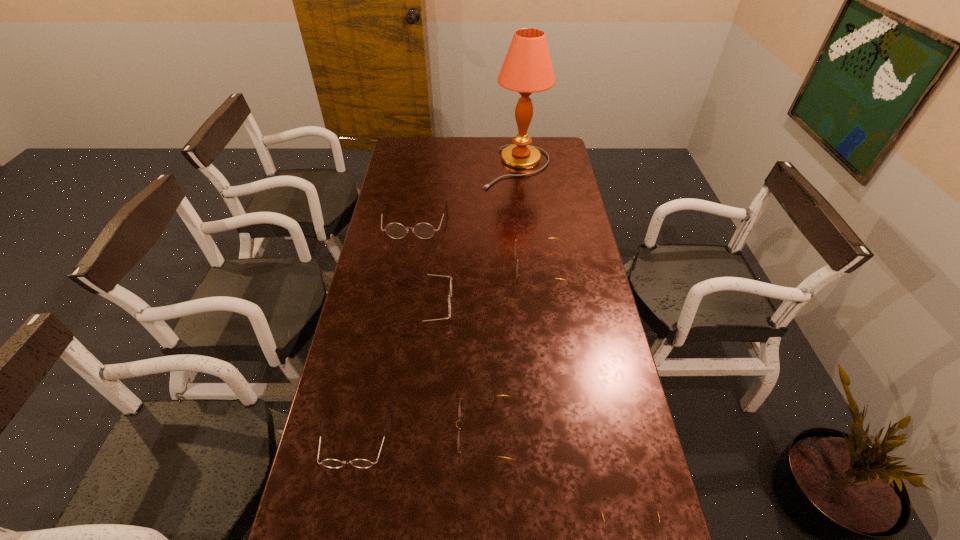
Where is `the farthest object`? This screenshot has height=540, width=960. the farthest object is located at coordinates (527, 68).

Where is `pink lamp`? pink lamp is located at coordinates (527, 68).

Locate an element on the screen. the farthest spectacles is located at coordinates (394, 230).

Locate an element on the screen. The width and height of the screenshot is (960, 540). the sixth nearest object is located at coordinates click(394, 230).

Identify the location of the farthest gold spectacles. (515, 245).

Where is `the second farthest dark spectacles`? This screenshot has height=540, width=960. the second farthest dark spectacles is located at coordinates (449, 300).

This screenshot has width=960, height=540. I want to click on the second nearest gold spectacles, so click(x=459, y=407).

Identify the location of the third spectacles from right to left. (459, 407).

Locate an element on the screen. The image size is (960, 540). the nearest dark spectacles is located at coordinates (330, 463).

Identify the location of vacant space positioned on the back of the tallest object. The height and width of the screenshot is (540, 960). point(514,140).